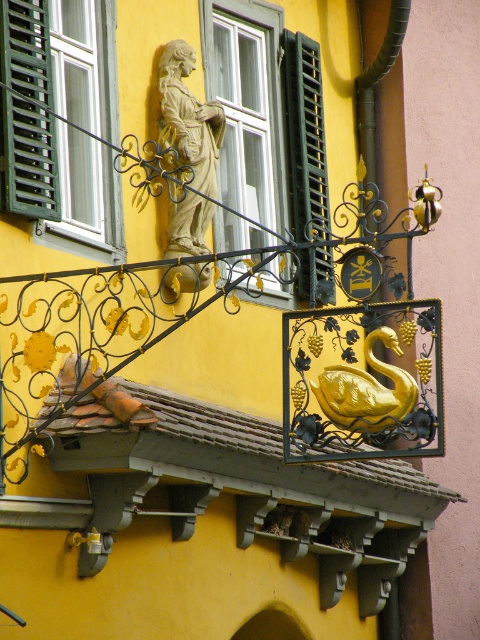
In the scene shown: Is green matte shutter at left thinner than stone statue at center?

Correct, green matte shutter at left's width is less than stone statue at center's.

Which is more to the left, green matte shutter at left or stone statue at center?

green matte shutter at left is more to the left.

At what (x,y) coordinates should I click in order to perform the action: click on green matte shutter at left. Please return your answer as a coordinate pair (x, y). Looking at the image, I should click on (27, 157).

Who is higher up, green matte shutter at upper left or black matte shutter at upper center?

Positioned higher is black matte shutter at upper center.

Who is taller, green matte shutter at upper left or black matte shutter at upper center?

Standing taller between the two is black matte shutter at upper center.

Is point (12, 180) positioned behind point (261, 161)?

No, it is not.

Identify the location of green matte shutter at upper left. Image resolution: width=480 pixels, height=640 pixels. (60, 182).

Between green matte shutter at upper left and stone statue at center, which one is positioned higher?

Positioned higher is green matte shutter at upper left.

Is point (26, 188) closer to viewer compared to point (204, 188)?

Yes, it is.

At what (x,y) coordinates should I click in order to perform the action: click on green matte shutter at upper left. Please return your answer as a coordinate pair (x, y). The width and height of the screenshot is (480, 640). Looking at the image, I should click on (60, 182).